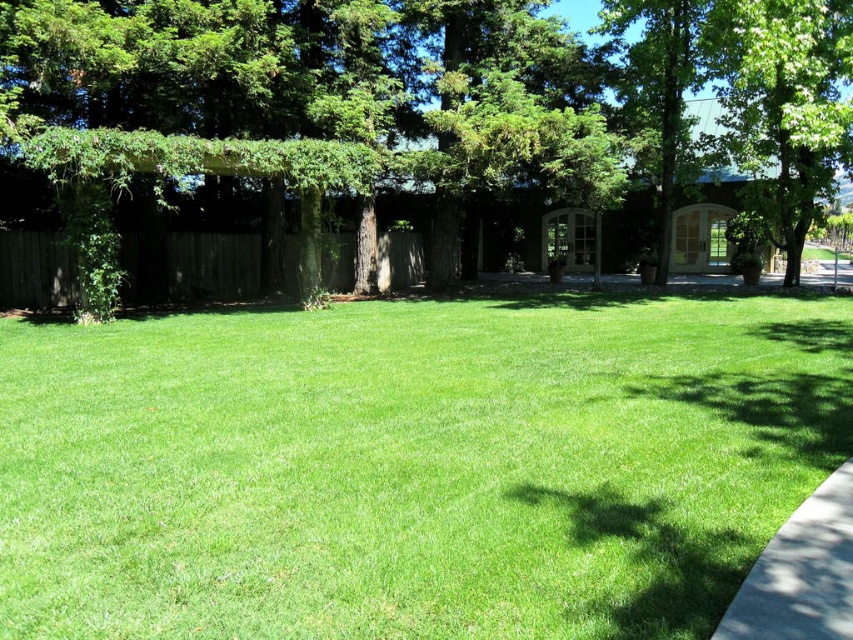
Question: Can you confirm if green grass at center is positioned above green leafy tree at center?

Choices:
 (A) no
 (B) yes

Answer: (A)

Question: Which of the following is the closest to the observer?

Choices:
 (A) click(x=294, y=381)
 (B) click(x=846, y=148)
 (C) click(x=776, y=625)
 (D) click(x=373, y=44)

Answer: (C)

Question: Which object is the closest to the green leafy tree at upper right?

Choices:
 (A) gray concrete sidewalk at lower right
 (B) green leafy tree at center

Answer: (A)

Question: Does green grass at center lie behind green leafy tree at center?

Choices:
 (A) no
 (B) yes

Answer: (A)

Question: Is green grass at center above green leafy tree at upper right?

Choices:
 (A) yes
 (B) no

Answer: (B)

Question: Which of the following is the closest to the observer?

Choices:
 (A) green leafy tree at upper right
 (B) green grass at center
 (C) green leafy tree at center

Answer: (B)